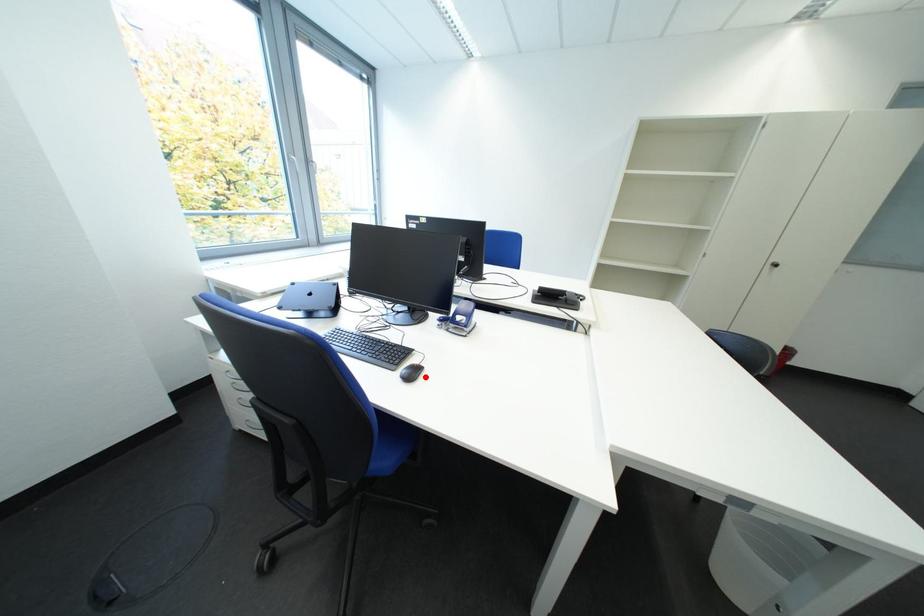
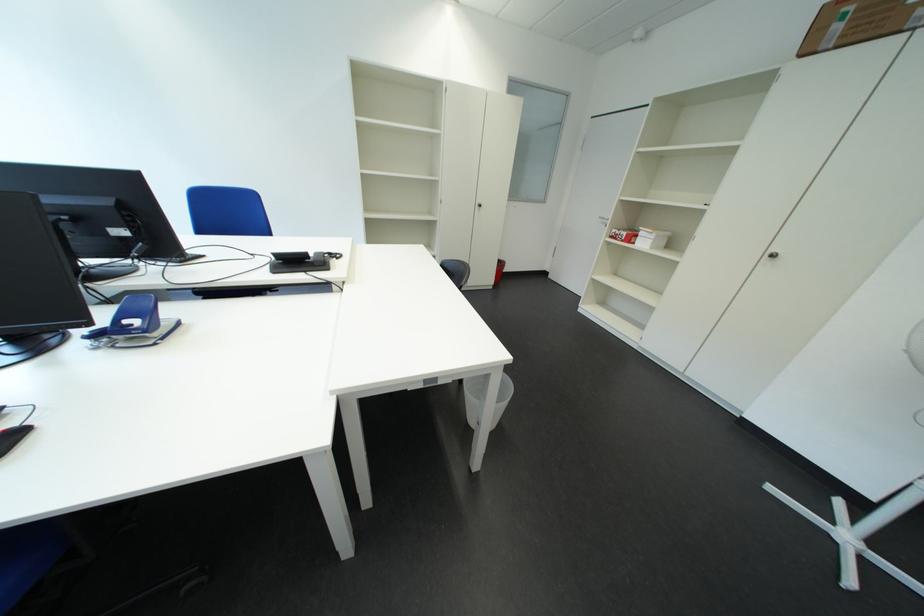
In the second image, find the point that corresponds to the highlighted location in the first image.

(6, 453)